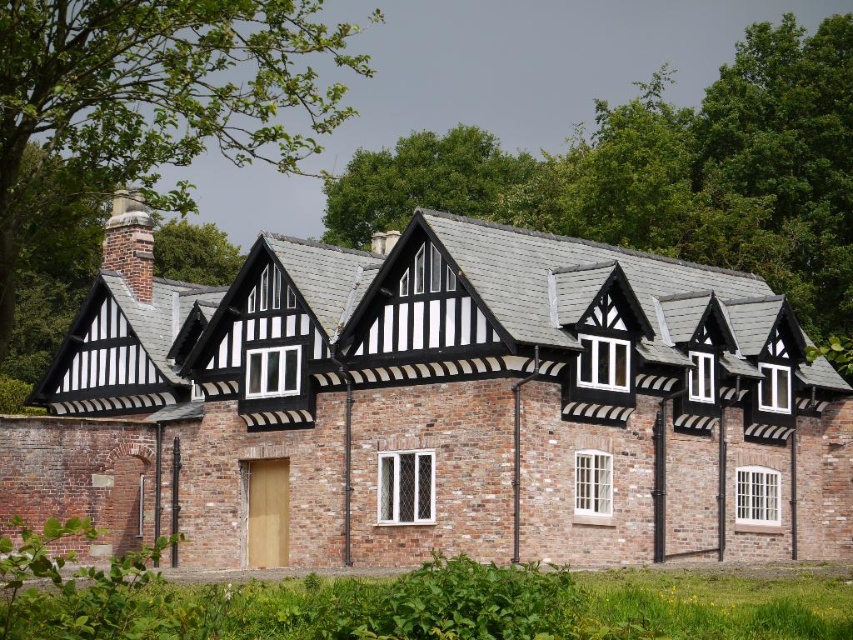
Between black timber trim at center and brick chimney at upper left, which one has more height?

black timber trim at center is taller.

Is point (550, 470) in front of point (131, 212)?

Yes.

Find the location of a particular element. black timber trim at center is located at coordinates (442, 408).